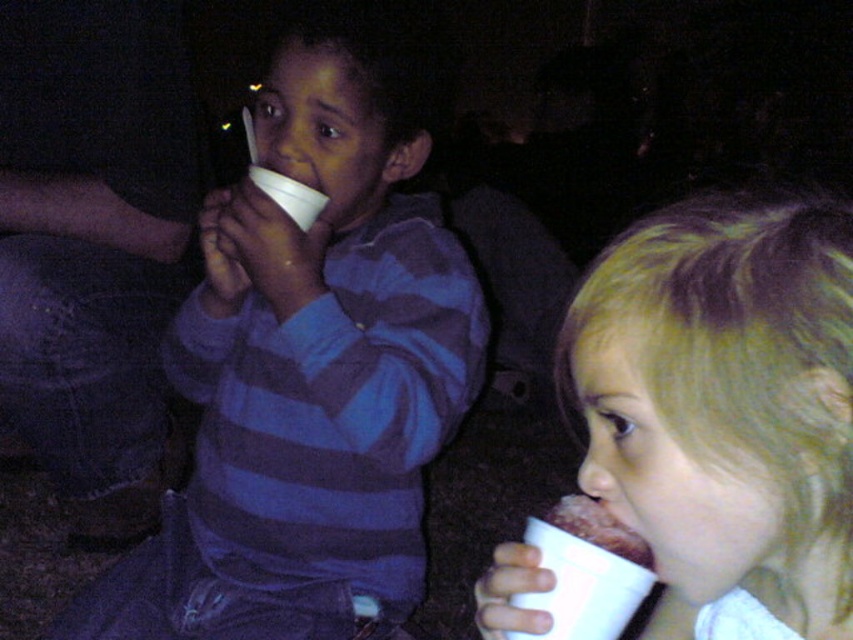
Does matte paper cup at center have a larger size compared to chocolate cake at lower right?

Indeed, matte paper cup at center has a larger size compared to chocolate cake at lower right.

Can you confirm if matte paper cup at center is positioned to the left of chocolate cake at lower right?

Indeed, matte paper cup at center is positioned on the left side of chocolate cake at lower right.

The height and width of the screenshot is (640, 853). Find the location of `matte paper cup at center`. matte paper cup at center is located at coordinates (308, 374).

At what (x,y) coordinates should I click in order to perform the action: click on matte paper cup at center. Please return your answer as a coordinate pair (x, y). This screenshot has width=853, height=640. Looking at the image, I should click on (308, 374).

Can you confirm if matte paper cup at center is taller than white paper cup at right?

Indeed, matte paper cup at center has a greater height compared to white paper cup at right.

Is point (355, 452) less distant than point (604, 273)?

No, it is not.

Who is more forward, (369, 282) or (717, 273)?

Point (717, 273) is in front.

Find the location of a particular element. matte paper cup at center is located at coordinates (308, 374).

Between point (821, 605) and point (561, 506), which one is positioned in front?

Positioned in front is point (821, 605).

Which of these two, white paper cup at right or chocolate cake at lower right, stands taller?

white paper cup at right is taller.

Image resolution: width=853 pixels, height=640 pixels. I want to click on white paper cup at right, so click(x=724, y=404).